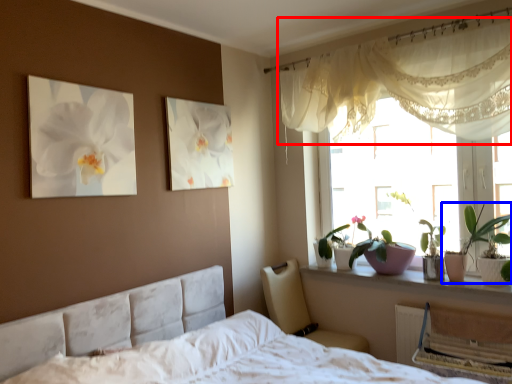
Question: Which object is further to the camera taking this photo, curtain (highlighted by a red box) or houseplant (highlighted by a blue box)?

Choices:
 (A) curtain
 (B) houseplant

Answer: (B)